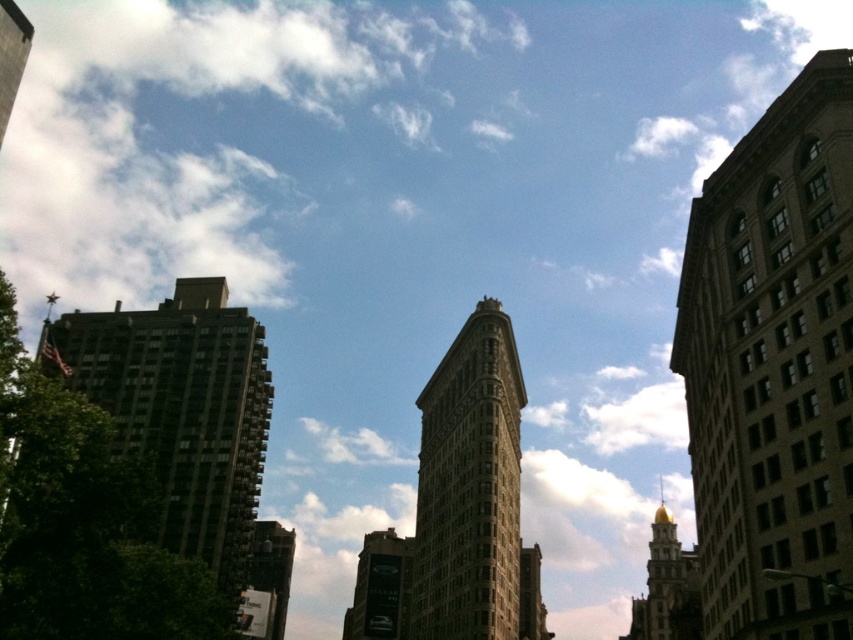
Who is lower down, brown stone building at center or gold polished dome at upper right?

gold polished dome at upper right

Does point (485, 387) come farther from viewer compared to point (639, 618)?

No, (485, 387) is in front of (639, 618).

Identify the location of brown stone building at center. The width and height of the screenshot is (853, 640). (469, 486).

Identify the location of brown stone building at center. The width and height of the screenshot is (853, 640). (469, 486).

Between point (706, 317) and point (439, 484), which one is positioned in front?

Positioned in front is point (706, 317).

Is brown brick building at right positioned in front of brown stone building at center?

Yes, brown brick building at right is in front of brown stone building at center.

Identify the location of brown brick building at right. (775, 368).

The height and width of the screenshot is (640, 853). Find the location of `brown brick building at right`. brown brick building at right is located at coordinates (775, 368).

Does brown brick building at right have a lesser height compared to gold polished dome at upper right?

Yes, brown brick building at right is shorter than gold polished dome at upper right.

Is the position of brown brick building at right less distant than that of gold polished dome at upper right?

That is True.

Looking at this image, who is more distant from viewer, (776,502) or (653,548)?

The point (653,548) is more distant.

This screenshot has height=640, width=853. Find the location of `brown brick building at right`. brown brick building at right is located at coordinates (775, 368).